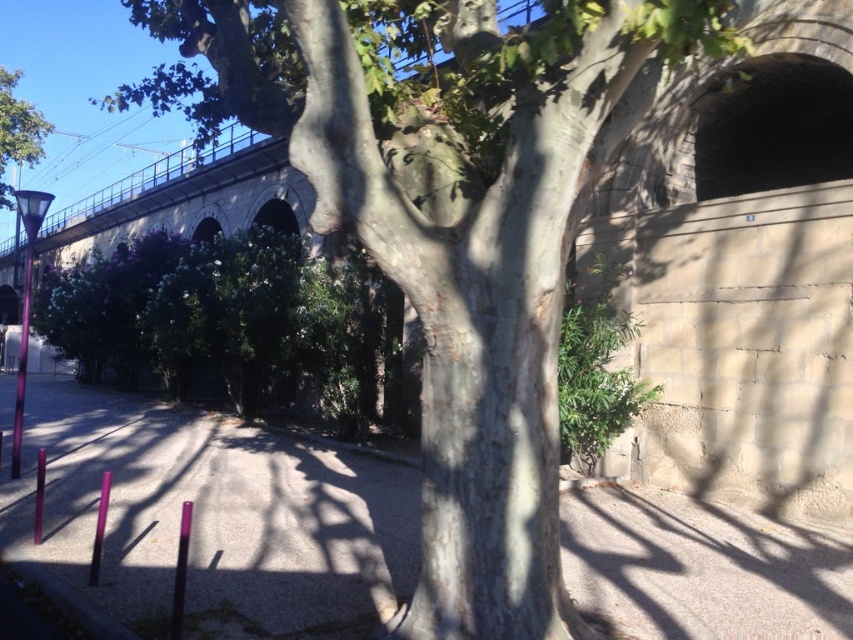
Does dark concrete tunnel at upper right appear over green leafy tree at upper left?

No, dark concrete tunnel at upper right is not above green leafy tree at upper left.

Does point (764, 180) come in front of point (33, 154)?

Yes, it is.

The height and width of the screenshot is (640, 853). Find the location of `dark concrete tunnel at upper right`. dark concrete tunnel at upper right is located at coordinates [x=773, y=125].